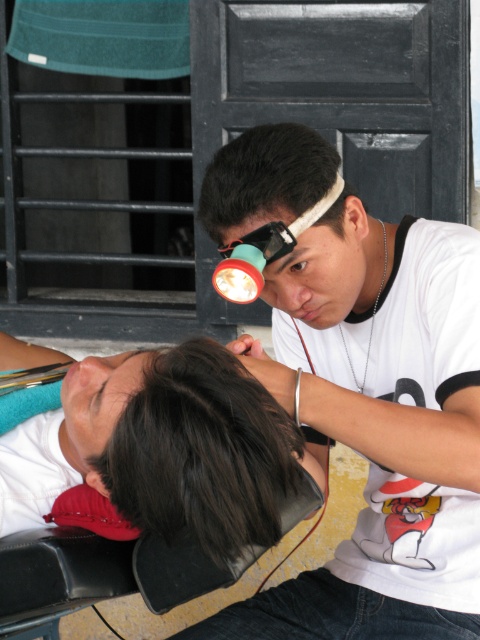
Question: Does white matte headlamp at upper center appear over dark brown hair at center?

Choices:
 (A) yes
 (B) no

Answer: (A)

Question: Among these objects, which one is farthest from the camera?

Choices:
 (A) matte black ear at lower left
 (B) white matte headlamp at upper center

Answer: (B)

Question: Which point is closer to the camera taking this photo?

Choices:
 (A) (291, 260)
 (B) (444, 620)
 (C) (189, 346)

Answer: (C)

Question: Estimate the real-world distances between objects in this image. Which object is closer to the matte black ear at lower left?

Choices:
 (A) dark brown hair at center
 (B) white matte headlamp at upper center

Answer: (A)

Question: Can you confirm if dark brown hair at center is thinner than matte black ear at lower left?

Choices:
 (A) yes
 (B) no

Answer: (B)

Question: Can you confirm if matte black ear at lower left is positioned above brown matte eye at center?

Choices:
 (A) no
 (B) yes

Answer: (A)